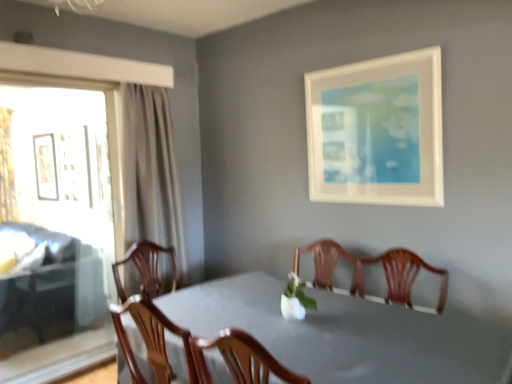
This screenshot has width=512, height=384. I want to click on blank area beneath white matte vase at center (from a real-world perspective), so pyautogui.click(x=300, y=312).